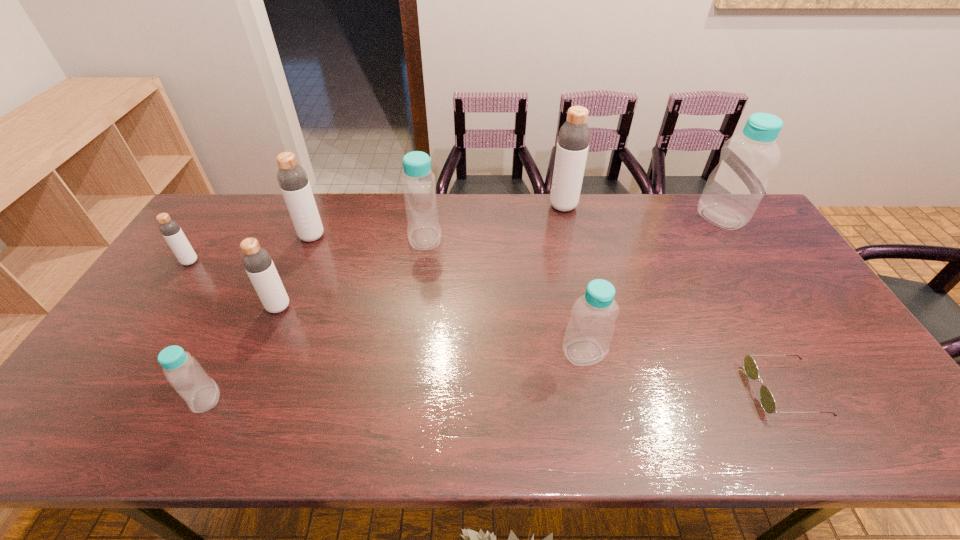
This screenshot has height=540, width=960. Identify the location of the biggest gray bottle. (574, 136).

Find the location of a particular element. This screenshot has width=960, height=540. the farthest gray bottle is located at coordinates (574, 136).

Find the location of `the biggest blue bottle`. the biggest blue bottle is located at coordinates (734, 189).

Locate an element on the screen. The width and height of the screenshot is (960, 540). the rightmost bottle is located at coordinates coord(734,189).

Find the location of `the fifth object from right to left`. the fifth object from right to left is located at coordinates (418, 182).

The width and height of the screenshot is (960, 540). I want to click on the fifth bottle from left to right, so click(x=418, y=182).

Locate an element on the screen. The image size is (960, 540). the second farthest gray bottle is located at coordinates (292, 178).

The image size is (960, 540). Find the location of `the fourth nearest object`. the fourth nearest object is located at coordinates (256, 260).

Find the location of a particular element. The height and width of the screenshot is (540, 960). the second smallest gray bottle is located at coordinates (256, 260).

Locate an element on the screen. The width and height of the screenshot is (960, 540). the second blue bottle from right to left is located at coordinates (589, 332).